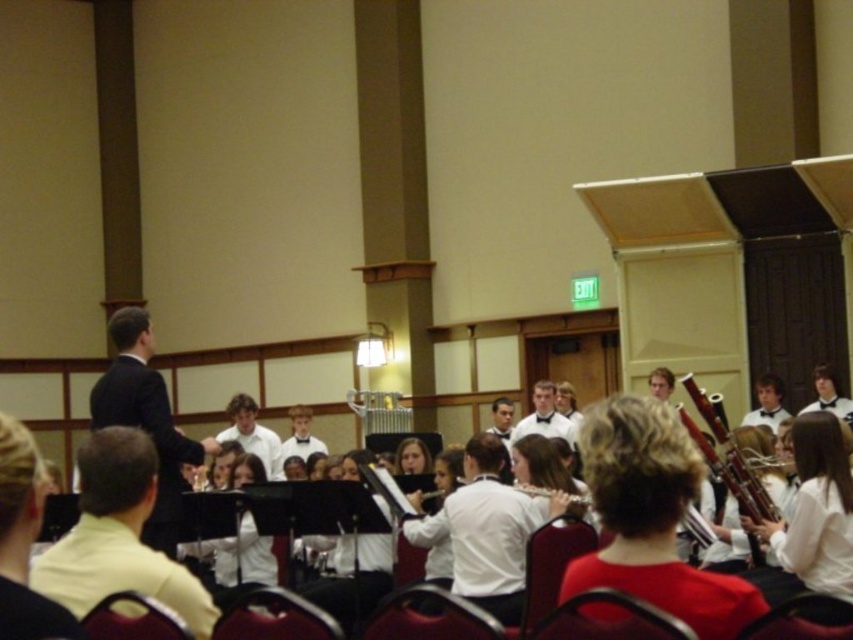
In the image of the music performance, where exactly is the wooden bassoon at right located?

The wooden bassoon at right is located at point (727, 458).

You are sitting in the audience of the music performance. You notice a specific point marked at coordinate (252, 435). What object is this point located on?

The point at coordinate (252, 435) is on the white smooth shirt at center.

You are standing in the auditorium and want to know how far the point at coordinates (x=111, y=376) is from you. Can you determine the distance?

The point at coordinates (x=111, y=376) is 28.38 meters away from you.